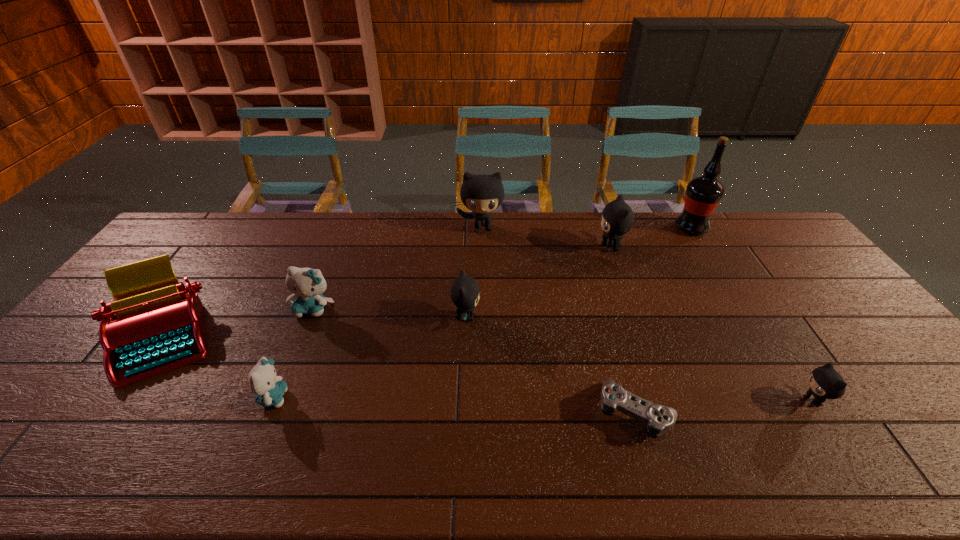
At what (x,y) coordinates should I click in order to perform the action: click on free space that is in between the farther blue kitten and the control. Please return your answer as a coordinate pair (x, y). This screenshot has width=960, height=540. Looking at the image, I should click on (474, 361).

Find the location of a particular element. The width and height of the screenshot is (960, 540). blank region between the bigger blue kitten and the shortest object is located at coordinates (474, 361).

Locate an element on the screen. vacant area that lies between the leftmost object and the nearer blue kitten is located at coordinates (218, 367).

This screenshot has width=960, height=540. What are the coordinates of `vacant space that is in between the tallest object and the second nearest gray kitten` in the screenshot? It's located at (579, 273).

Where is `free space between the control and the tallest kitten`? free space between the control and the tallest kitten is located at coordinates (559, 320).

The height and width of the screenshot is (540, 960). Identify the location of the sixth closest object to the third biggest gray kitten. (153, 326).

Find the location of a particular element. object that is the seventh closest one to the rightmost kitten is located at coordinates (269, 389).

Where is `kitten that is the fifth closest one to the smallest gray kitten`? This screenshot has height=540, width=960. kitten that is the fifth closest one to the smallest gray kitten is located at coordinates (269, 389).

Locate an element on the screen. The height and width of the screenshot is (540, 960). the third closest kitten to the smaller blue kitten is located at coordinates (482, 194).

This screenshot has height=540, width=960. Identify the location of gray kitten that is the fourth closest one to the typewriter. (825, 382).